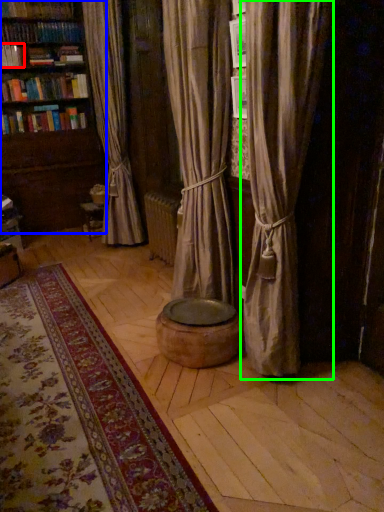
Question: Estimate the real-world distances between objects in this image. Which object is farther from book (highlighted by a red box), bookcase (highlighted by a blue box) or curtain (highlighted by a green box)?

Choices:
 (A) bookcase
 (B) curtain

Answer: (B)